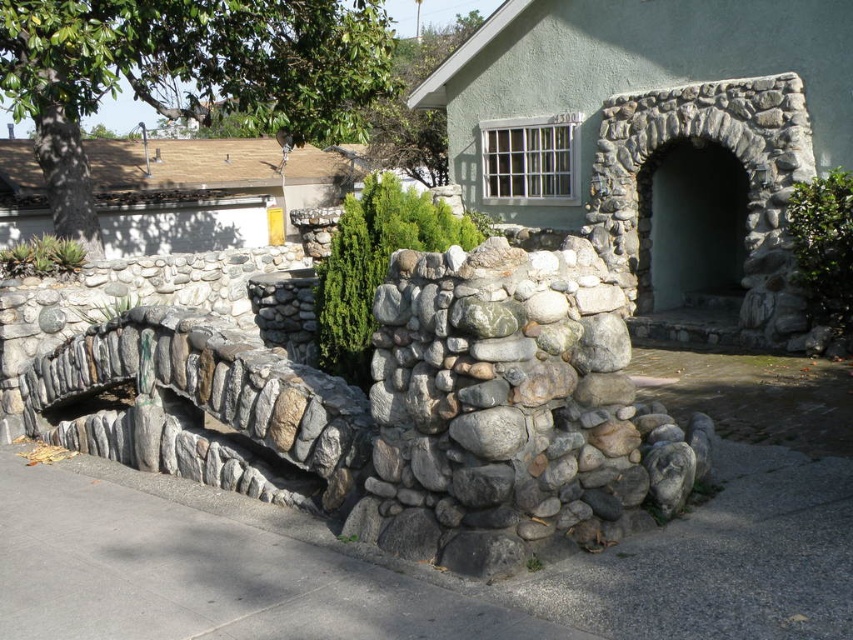
Who is higher up, gray concrete pavement at center or gray concrete pavement at lower left?

gray concrete pavement at lower left is above.

How much distance is there between gray concrete pavement at center and gray concrete pavement at lower left?

gray concrete pavement at center is 4.07 feet from gray concrete pavement at lower left.

Describe the element at coordinates (440, 573) in the screenshot. I see `gray concrete pavement at center` at that location.

At what (x,y) coordinates should I click in order to perform the action: click on gray concrete pavement at center. Please return your answer as a coordinate pair (x, y). This screenshot has height=640, width=853. Looking at the image, I should click on tap(440, 573).